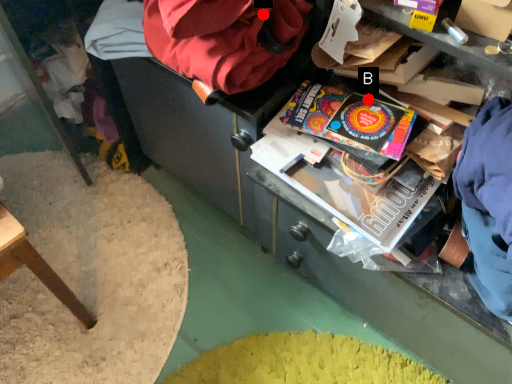
Question: Two points are circled on the image, labeled by A and B beside each circle. Which point is closer to the camera?

Choices:
 (A) A is closer
 (B) B is closer

Answer: (A)